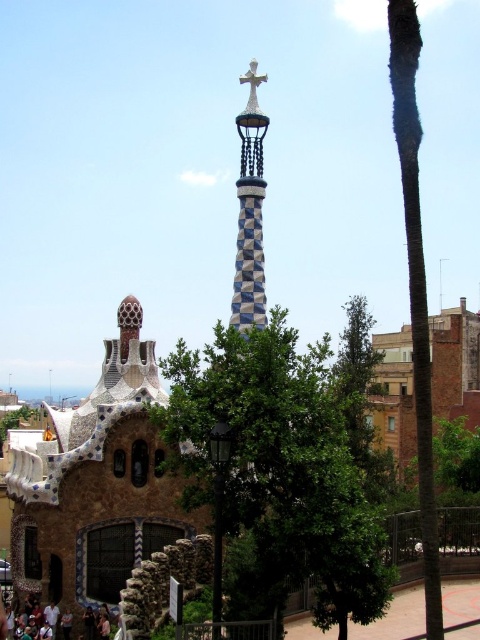
Is point (252, 262) closer to viewer compared to point (3, 612)?

No, it is behind (3, 612).

Is point (249, 120) positioned before point (4, 634)?

No, (249, 120) is further to viewer.

Find the location of a particular element. This screenshot has height=640, width=480. blue and white mosaic spire at center is located at coordinates (250, 211).

Is blue and white mosaic spire at center further to the viewer compared to gold metallic cross at upper center?

No, it is not.

Who is higher up, blue and white mosaic spire at center or gold metallic cross at upper center?

Positioned higher is gold metallic cross at upper center.

You are a GUI agent. You are given a task and a screenshot of the screen. Output one action in this format:
    pyautogui.click(x=<x>, y=<y>)
    Task: Click on the blue and white mosaic spire at center
    Image resolution: width=480 pixels, height=640 pixels.
    Given the screenshot: What is the action you would take?
    pyautogui.click(x=250, y=211)

The width and height of the screenshot is (480, 640). Identify the location of blue and white mosaic spire at center. (250, 211).

Looking at this image, can you confirm if gold metallic cross at upper center is positioned below dark brown leather shoes at lower left?

No.

From the picture: Does gold metallic cross at upper center have a greater width compared to dark brown leather shoes at lower left?

In fact, gold metallic cross at upper center might be narrower than dark brown leather shoes at lower left.

Where is `gold metallic cross at upper center`? gold metallic cross at upper center is located at coordinates (252, 88).